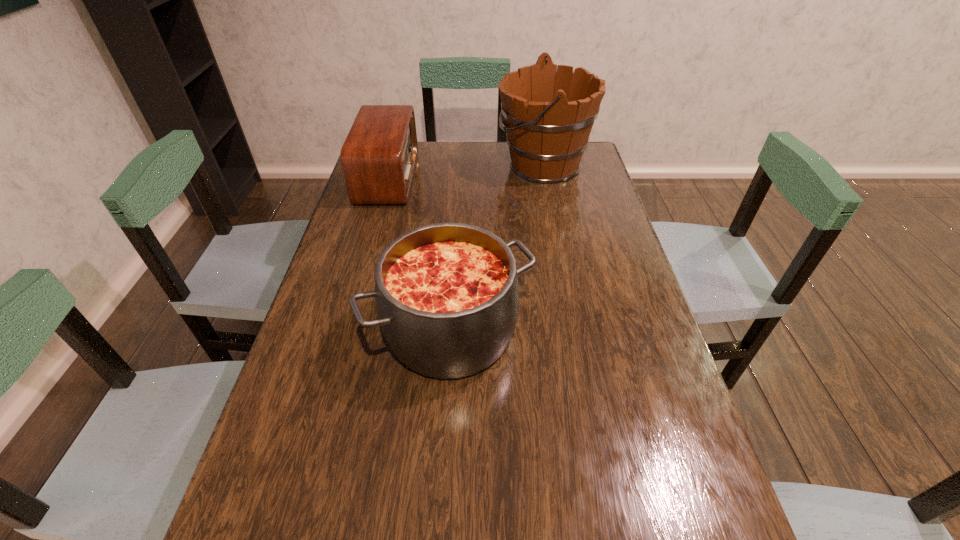
Locate an element on the screen. The image size is (960, 540). casserole at the left edge is located at coordinates (447, 294).

Identify the location of radio receiver that is at the left edge. (378, 158).

Locate an element on the screen. object located at the right edge is located at coordinates [549, 115].

Where is `object positioned at the far left corner`? object positioned at the far left corner is located at coordinates (378, 158).

The width and height of the screenshot is (960, 540). I want to click on object present at the far right corner, so click(x=549, y=115).

I want to click on free spot at the far edge of the desktop, so click(x=457, y=174).

In the image, there is a desktop. At what (x,y) coordinates should I click in order to perform the action: click on blank space at the left edge. Please return your answer as a coordinate pair (x, y). Looking at the image, I should click on (359, 212).

This screenshot has width=960, height=540. Find the location of `free space at the right edge of the desktop`. free space at the right edge of the desktop is located at coordinates (582, 264).

Find the location of a particular element. The width and height of the screenshot is (960, 540). empty space between the radio receiver and the tallest object is located at coordinates (466, 171).

Identify the location of vacant point located between the tallest object and the radio receiver. The width and height of the screenshot is (960, 540). (466, 171).